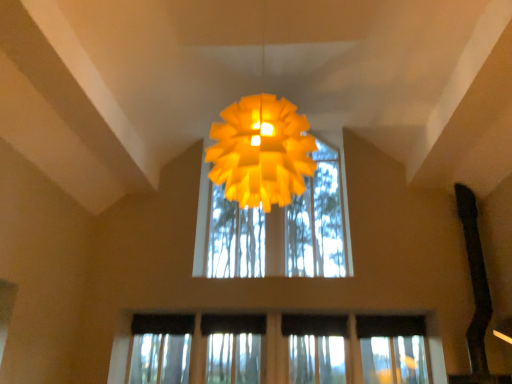
Question: In terms of width, does matte yellow paper lamp at center look wider or thinner when compared to transparent glass window at center?

Choices:
 (A) thin
 (B) wide

Answer: (B)

Question: From a real-world perspective, is matte yellow paper lamp at center above or below transparent glass window at center?

Choices:
 (A) below
 (B) above

Answer: (B)

Question: Is matte yellow paper lamp at center situated inside transparent glass window at center or outside?

Choices:
 (A) inside
 (B) outside

Answer: (B)

Question: Would you say transparent glass window at center is to the left or to the right of matte yellow paper lamp at center in the picture?

Choices:
 (A) left
 (B) right

Answer: (B)

Question: Which is correct: transparent glass window at center is inside matte yellow paper lamp at center, or outside of it?

Choices:
 (A) inside
 (B) outside

Answer: (B)

Question: Based on their sizes in the image, would you say transparent glass window at center is bigger or smaller than matte yellow paper lamp at center?

Choices:
 (A) big
 (B) small

Answer: (B)

Question: Looking at their shapes, would you say transparent glass window at center is wider or thinner than matte yellow paper lamp at center?

Choices:
 (A) wide
 (B) thin

Answer: (B)